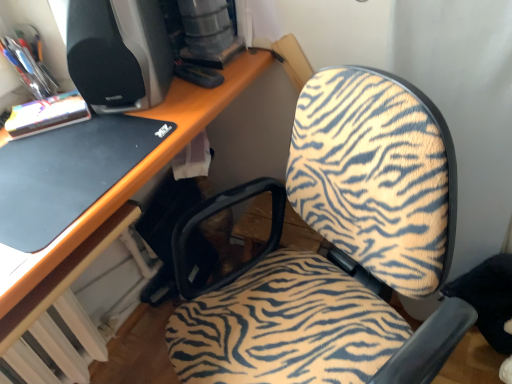
Question: Is black matte laptop at left looking in the opposite direction of zebra-patterned fabric chair at center?

Choices:
 (A) yes
 (B) no

Answer: (B)

Question: From the image's perspective, is black matte laptop at left on zebra-patterned fabric chair at center?

Choices:
 (A) no
 (B) yes

Answer: (B)

Question: Can you confirm if black matte laptop at left is bigger than zebra-patterned fabric chair at center?

Choices:
 (A) yes
 (B) no

Answer: (B)

Question: From the image's perspective, is black matte laptop at left under zebra-patterned fabric chair at center?

Choices:
 (A) no
 (B) yes

Answer: (A)

Question: Considering the relative sizes of black matte laptop at left and zebra-patterned fabric chair at center in the image provided, is black matte laptop at left shorter than zebra-patterned fabric chair at center?

Choices:
 (A) yes
 (B) no

Answer: (A)

Question: Considering the positions of point (x=281, y=258) and point (x=31, y=231), is point (x=281, y=258) closer or farther from the camera than point (x=31, y=231)?

Choices:
 (A) farther
 (B) closer

Answer: (A)

Question: Considering the positions of zebra-patterned fabric chair at center and black matte laptop at left in the image, is zebra-patterned fabric chair at center bigger or smaller than black matte laptop at left?

Choices:
 (A) small
 (B) big

Answer: (B)

Question: Is zebra-patterned fabric chair at center taller or shorter than black matte laptop at left?

Choices:
 (A) tall
 (B) short

Answer: (A)

Question: In terms of width, does zebra-patterned fabric chair at center look wider or thinner when compared to black matte laptop at left?

Choices:
 (A) thin
 (B) wide

Answer: (B)

Question: In the image, is black matte laptop at left positioned in front of or behind zebra-patterned fabric chair at center?

Choices:
 (A) front
 (B) behind

Answer: (B)

Question: From the image's perspective, is black matte laptop at left above or below zebra-patterned fabric chair at center?

Choices:
 (A) below
 (B) above

Answer: (B)

Question: From their relative heights in the image, would you say black matte laptop at left is taller or shorter than zebra-patterned fabric chair at center?

Choices:
 (A) tall
 (B) short

Answer: (B)

Question: From a real-world perspective, is black matte laptop at left above or below zebra-patterned fabric chair at center?

Choices:
 (A) below
 (B) above

Answer: (B)

Question: Based on their positions, is black plastic desktop computer at upper left located to the left or right of black matte laptop at left?

Choices:
 (A) left
 (B) right

Answer: (B)

Question: Is black plastic desktop computer at upper left wider or thinner than black matte laptop at left?

Choices:
 (A) thin
 (B) wide

Answer: (A)